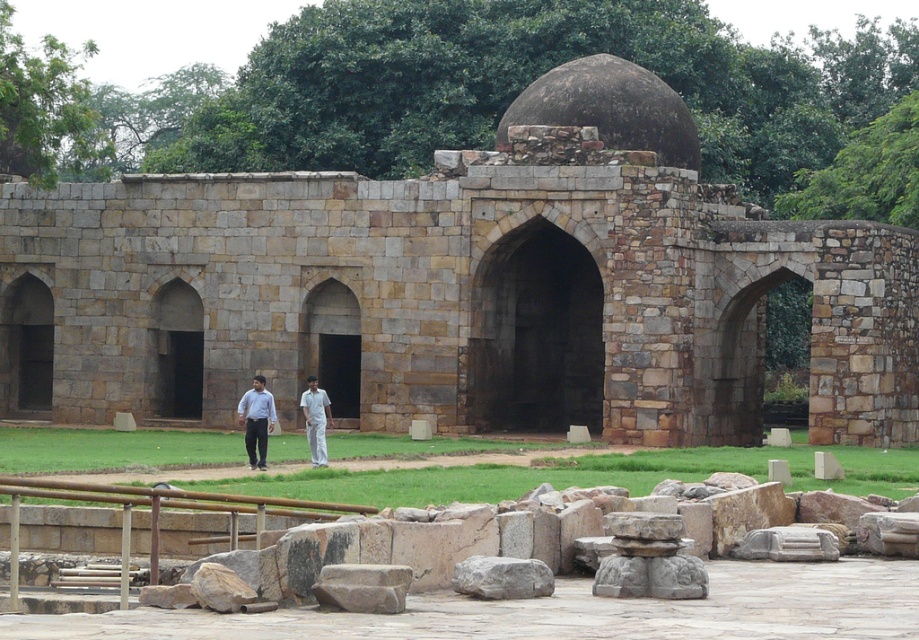
Question: Is gray rough stone at center positioned behind light blue shirt at center?

Choices:
 (A) no
 (B) yes

Answer: (A)

Question: In this image, where is gray rough stone at center located relative to light blue shirt at center?

Choices:
 (A) right
 (B) left

Answer: (A)

Question: Among these objects, which one is farthest from the camera?

Choices:
 (A) gray rough stone at center
 (B) light blue shirt at center
 (C) brown stone archway at center

Answer: (C)

Question: Which object is positioned farthest from the light blue shirt at center?

Choices:
 (A) white cotton shirt at center
 (B) brown stone archway at center

Answer: (B)

Question: Considering the relative positions of light blue shirt at center and white cotton shirt at center in the image provided, where is light blue shirt at center located with respect to white cotton shirt at center?

Choices:
 (A) below
 (B) above

Answer: (B)

Question: Which object appears closest to the camera in this image?

Choices:
 (A) gray rough stone at center
 (B) brown stone archway at center

Answer: (A)